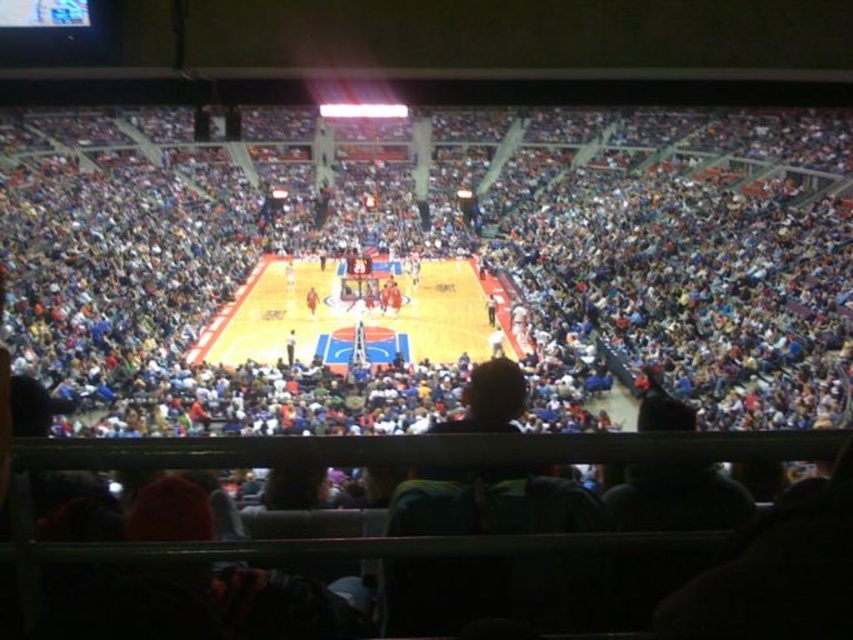
You are a basketball coach observing the game. You notice the wooden basketball court at center and the orange jersey at center. Which object occupies more space in the image?

The wooden basketball court at center occupies more space in the image compared to the orange jersey at center because it is larger in size.